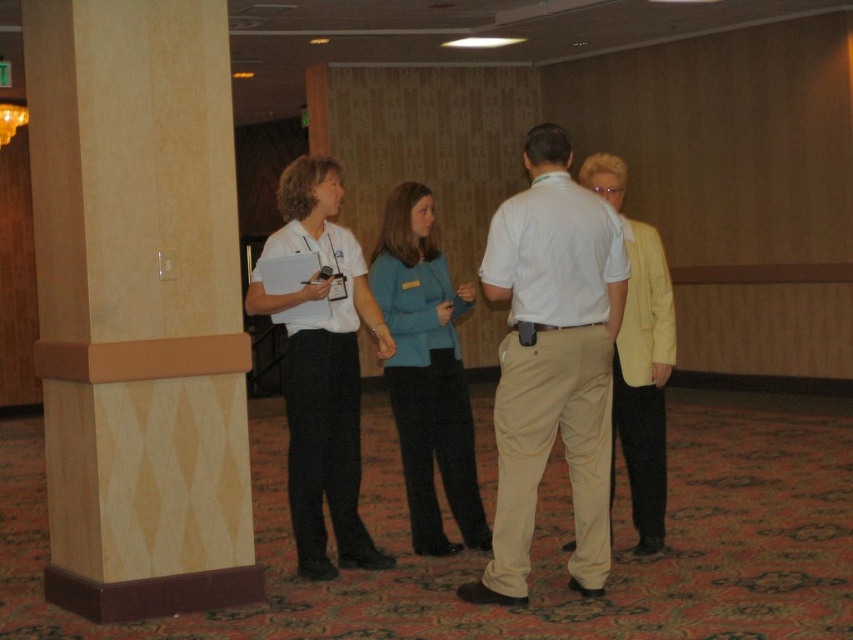
Is white cotton shirt at center wider than white matte shirt at center?

Yes.

Who is higher up, white cotton shirt at center or white matte shirt at center?

white cotton shirt at center

Is point (546, 157) closer to camera compared to point (357, 472)?

Yes, it is in front of point (357, 472).

You are a GUI agent. You are given a task and a screenshot of the screen. Output one action in this format:
    pyautogui.click(x=<x>, y=<y>)
    Task: Click on the white cotton shirt at center
    The width and height of the screenshot is (853, 640).
    Given the screenshot: What is the action you would take?
    pyautogui.click(x=552, y=362)

Can you confirm if white matte shirt at center is wider than teal fabric jacket at center?

Yes.

Can you confirm if white matte shirt at center is positioned to the left of teal fabric jacket at center?

Indeed, white matte shirt at center is positioned on the left side of teal fabric jacket at center.

Is point (316, 472) positioned in front of point (374, 259)?

Yes, point (316, 472) is in front of point (374, 259).

This screenshot has width=853, height=640. Identify the location of white matte shirt at center. (323, 369).

Is white cotton shirt at center to the left of teal fabric jacket at center from the viewer's perspective?

In fact, white cotton shirt at center is to the right of teal fabric jacket at center.

Does white cotton shirt at center appear under teal fabric jacket at center?

Incorrect, white cotton shirt at center is not positioned below teal fabric jacket at center.

This screenshot has height=640, width=853. I want to click on white cotton shirt at center, so click(x=552, y=362).

Where is `white cotton shirt at center`? white cotton shirt at center is located at coordinates (552, 362).